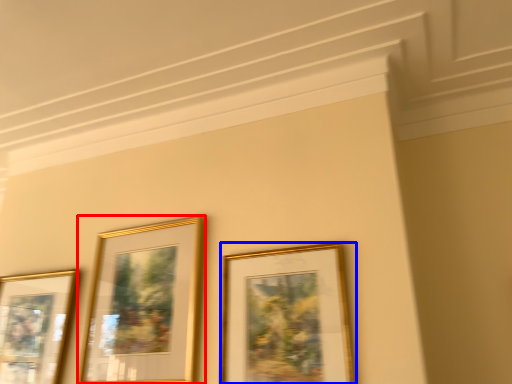
Question: Which object appears closest to the camera in this image, picture frame (highlighted by a red box) or picture frame (highlighted by a blue box)?

Choices:
 (A) picture frame
 (B) picture frame

Answer: (B)